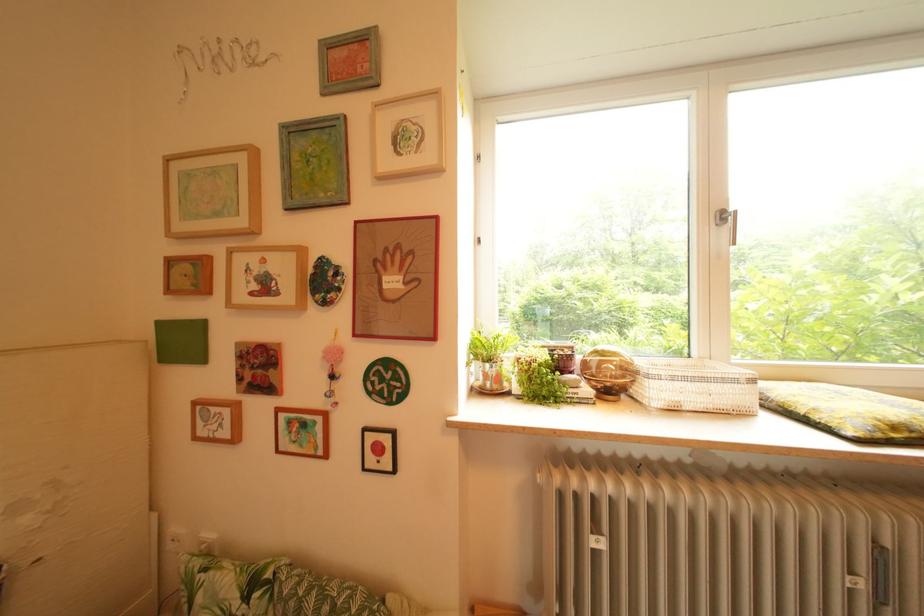
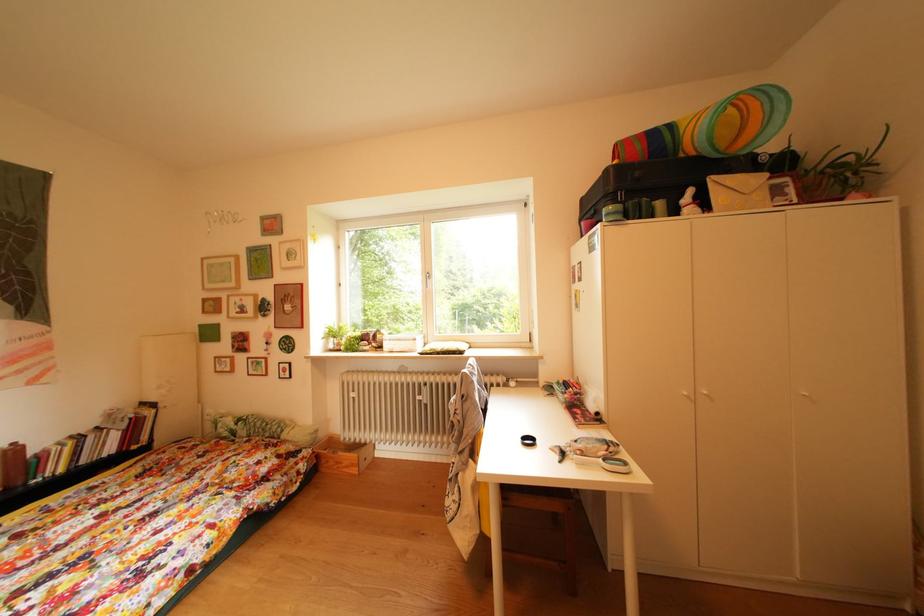
Which direction would the cameraman need to move to produce the second image?

Result: The movement direction of the cameraman is right, backward.